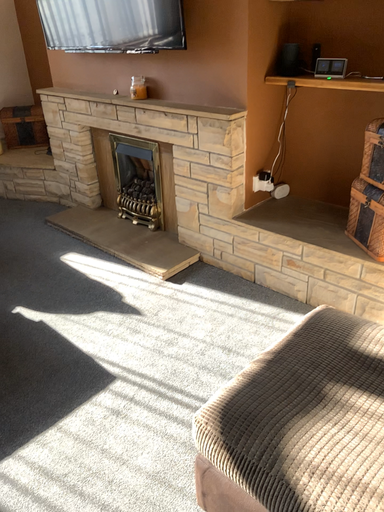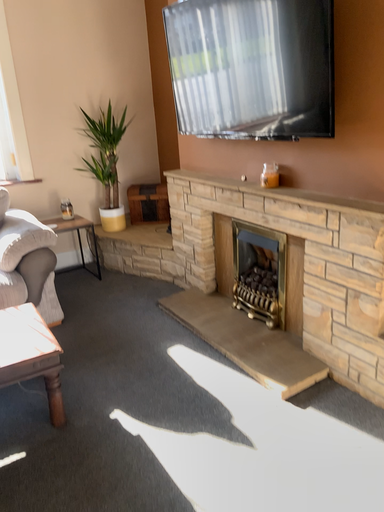
Question: How did the camera likely rotate when shooting the video?

Choices:
 (A) rotated left
 (B) rotated right

Answer: (A)